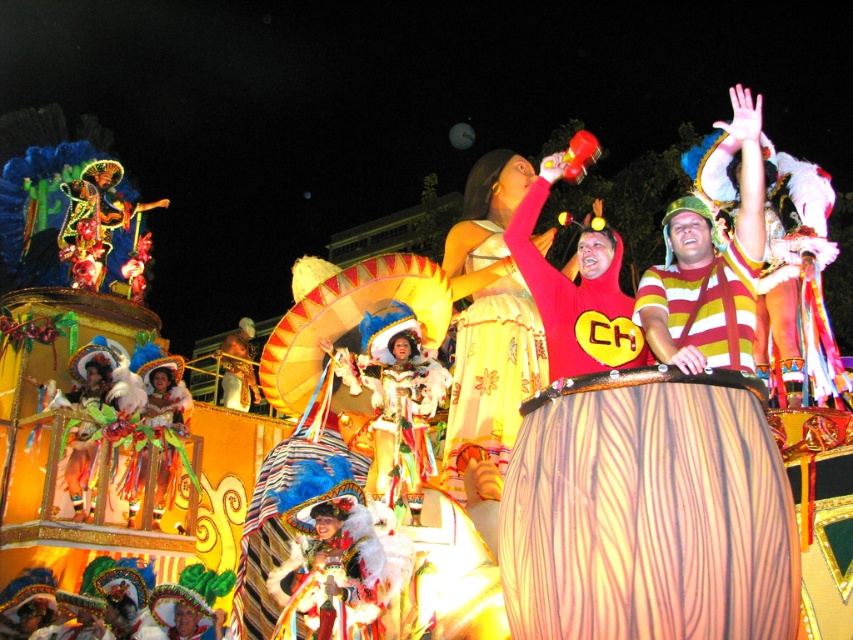
Is yellow striped shirt at upper right behind yellow fabric sombrero at center?

That is False.

Is yellow striped shirt at upper right to the left of yellow fabric sombrero at center from the viewer's perspective?

In fact, yellow striped shirt at upper right is to the right of yellow fabric sombrero at center.

The width and height of the screenshot is (853, 640). I want to click on yellow striped shirt at upper right, so click(711, 266).

The height and width of the screenshot is (640, 853). I want to click on yellow striped shirt at upper right, so click(711, 266).

Where is `yellow floral dress at center`? The height and width of the screenshot is (640, 853). yellow floral dress at center is located at coordinates (492, 372).

From the picture: Who is more forward, [543,340] or [173,416]?

Point [543,340] is in front.

Is point (532, 317) behind point (163, 488)?

No, it is in front of (163, 488).

I want to click on yellow floral dress at center, so click(x=492, y=372).

In the scene shown: Between yellow striped shirt at upper right and yellow floral dress at center, which one appears on the right side from the viewer's perspective?

yellow striped shirt at upper right is more to the right.

Is yellow striped shirt at upper right below yellow floral dress at center?

No, yellow striped shirt at upper right is not below yellow floral dress at center.

Does point (711, 236) come closer to viewer compared to point (490, 445)?

That is True.

The width and height of the screenshot is (853, 640). Identify the location of yellow striped shirt at upper right. (711, 266).